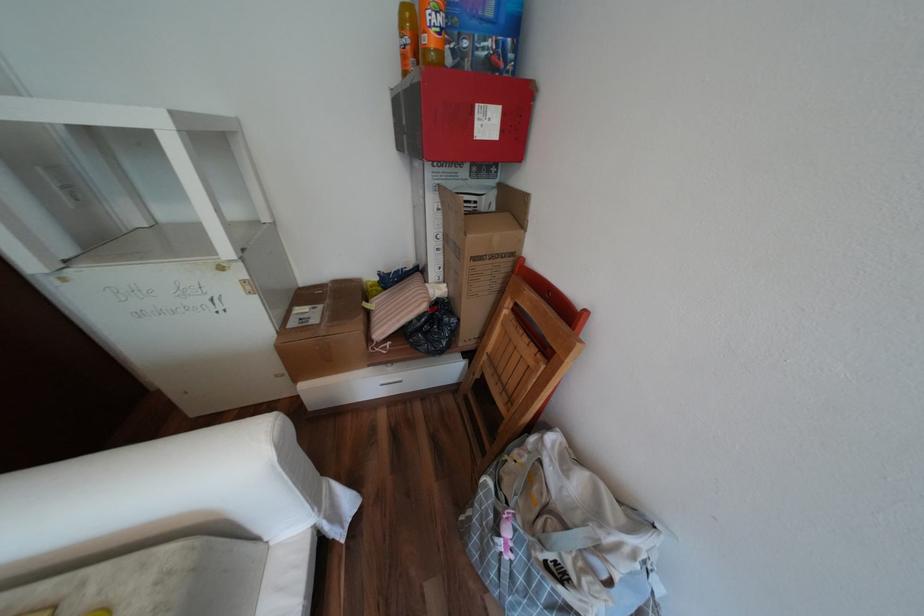
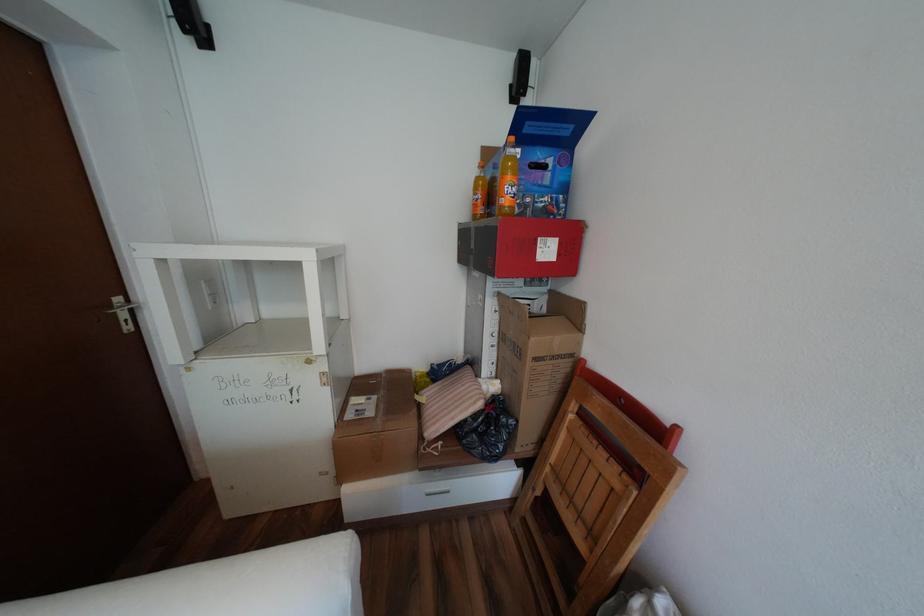
In the second image, find the point that corresponds to (x=433, y=31) in the first image.

(512, 197)